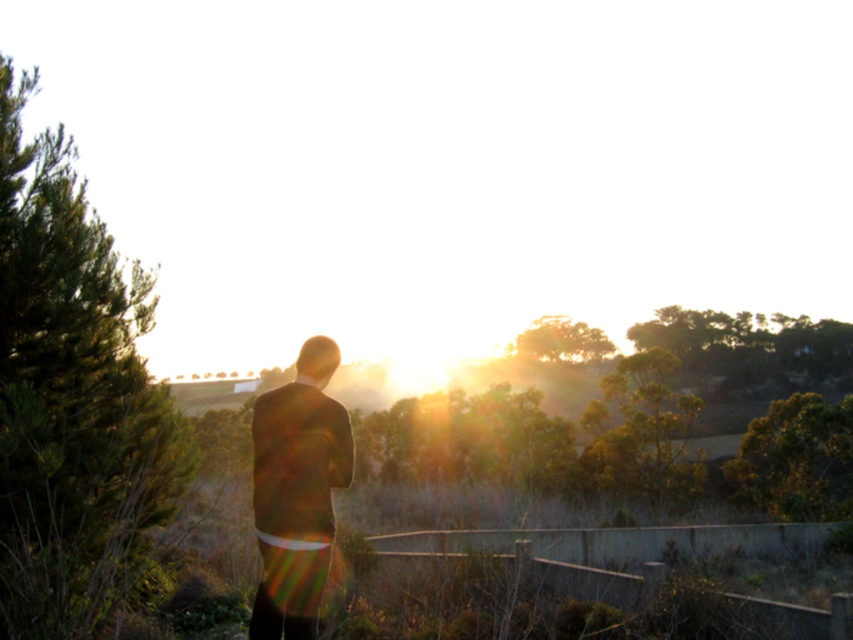
Who is lower down, dark brown suit at center or green leafy tree at right?

Positioned lower is green leafy tree at right.

Is point (314, 609) positioned before point (770, 484)?

That is True.

Which is behind, point (325, 508) or point (793, 440)?

The point (793, 440) is behind.

The image size is (853, 640). I want to click on dark brown suit at center, so click(x=297, y=492).

Does green leafy tree at left come behind green leafy tree at center?

That is False.

Which of these two, green leafy tree at left or green leafy tree at center, stands taller?

Standing taller between the two is green leafy tree at center.

At what (x,y) coordinates should I click in order to perform the action: click on green leafy tree at left. Please return your answer as a coordinate pair (x, y). Looking at the image, I should click on (73, 396).

Find the location of `green leafy tree at left`. green leafy tree at left is located at coordinates (73, 396).

From the picture: Can you confirm if dark brown suit at center is positioned to the left of green leafy tree at center?

Yes, dark brown suit at center is to the left of green leafy tree at center.

Which is behind, point (281, 540) or point (653, 385)?

The point (653, 385) is more distant.

Locate an element on the screen. This screenshot has width=853, height=640. dark brown suit at center is located at coordinates tap(297, 492).